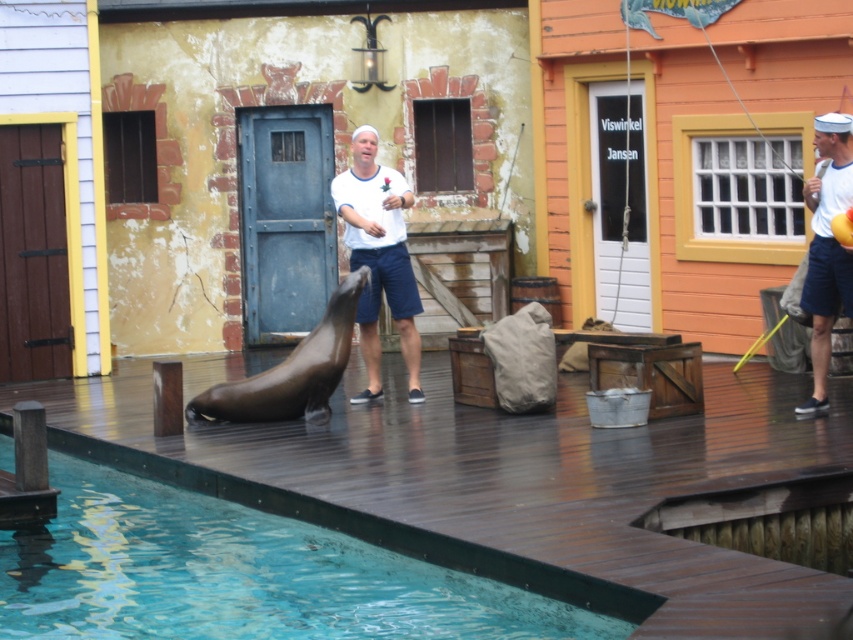
You are a photographer trying to capture both the white cotton shirt at center and the white cotton shirt at upper right in a single frame. Which shirt should you focus on first to ensure both are in the frame?

You should focus on the white cotton shirt at center first because it is wider and might require more space in the frame to capture fully.

In the scene shown: You are a photographer trying to capture the seal performance. You notice the clear blue water at lower left and the white cotton shirt at upper right in your frame. Which object takes up more horizontal space in the image?

The clear blue water at lower left takes up more horizontal space than the white cotton shirt at upper right because its width is larger.